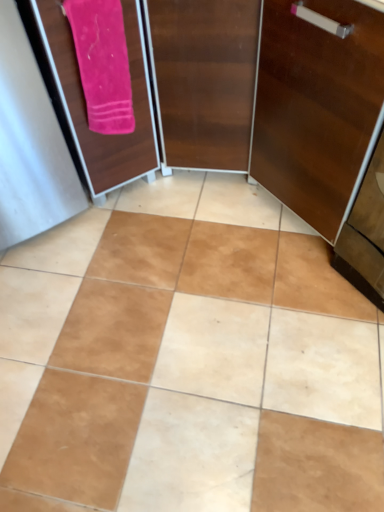
The height and width of the screenshot is (512, 384). I want to click on empty space that is ontop of brown matte tile at center, so click(x=181, y=313).